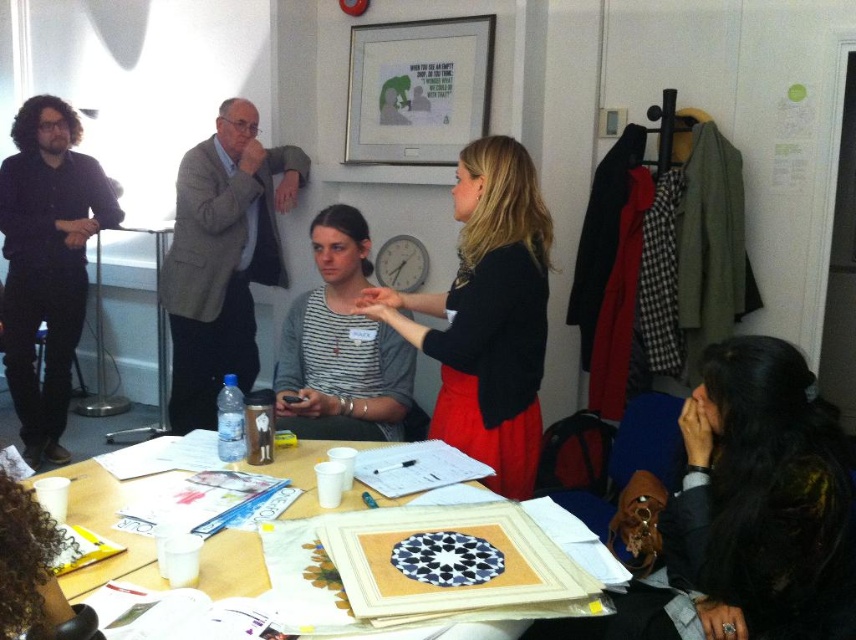
Question: Which point is farther from the camera taking this photo?

Choices:
 (A) (470, 129)
 (B) (217, 563)
 (C) (450, 291)

Answer: (A)

Question: Estimate the real-world distances between objects in this image. Which object is closer to the striped fabric shirt at center?

Choices:
 (A) matte silver picture frame at upper center
 (B) wooden table at center

Answer: (B)

Question: Is matte silver picture frame at upper center thinner than wooden table at center?

Choices:
 (A) no
 (B) yes

Answer: (B)

Question: Considering the relative positions of black matte skirt at center and striped fabric shirt at center in the image provided, where is black matte skirt at center located with respect to striped fabric shirt at center?

Choices:
 (A) right
 (B) left

Answer: (A)

Question: Does striped fabric shirt at center have a greater width compared to matte silver picture frame at upper center?

Choices:
 (A) yes
 (B) no

Answer: (B)

Question: Which of these objects is positioned farthest from the striped fabric shirt at center?

Choices:
 (A) black matte skirt at center
 (B) matte silver picture frame at upper center
 (C) wooden table at center

Answer: (B)